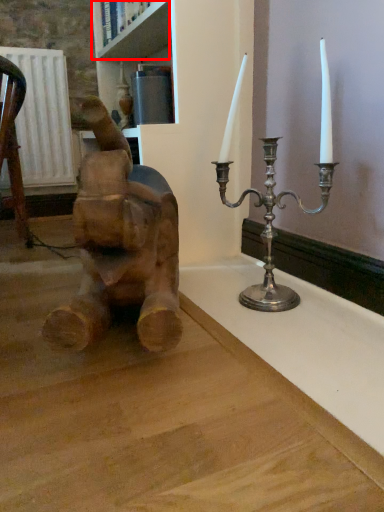
Question: Where is shelf (annotated by the red box) located in relation to statue (sculpture) in the image?

Choices:
 (A) right
 (B) left

Answer: (B)